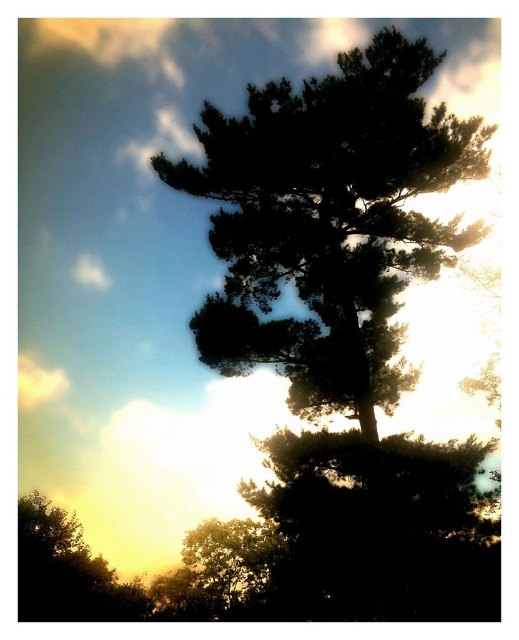
Question: Which point is closer to the camera?

Choices:
 (A) (34, 544)
 (B) (333, 80)

Answer: (B)

Question: Is silhouette pine at center to the right of green leafy tree at lower left from the viewer's perspective?

Choices:
 (A) no
 (B) yes

Answer: (B)

Question: Does silhouette pine at center appear over green leafy tree at lower left?

Choices:
 (A) yes
 (B) no

Answer: (A)

Question: Among these points, which one is nearest to the camera?

Choices:
 (A) (293, 369)
 (B) (58, 508)

Answer: (A)

Question: Is silhouette pine at center to the right of green leafy tree at lower left from the viewer's perspective?

Choices:
 (A) no
 (B) yes

Answer: (B)

Question: Which object is closer to the camera taking this photo?

Choices:
 (A) green leafy tree at lower left
 (B) silhouette pine at center

Answer: (B)